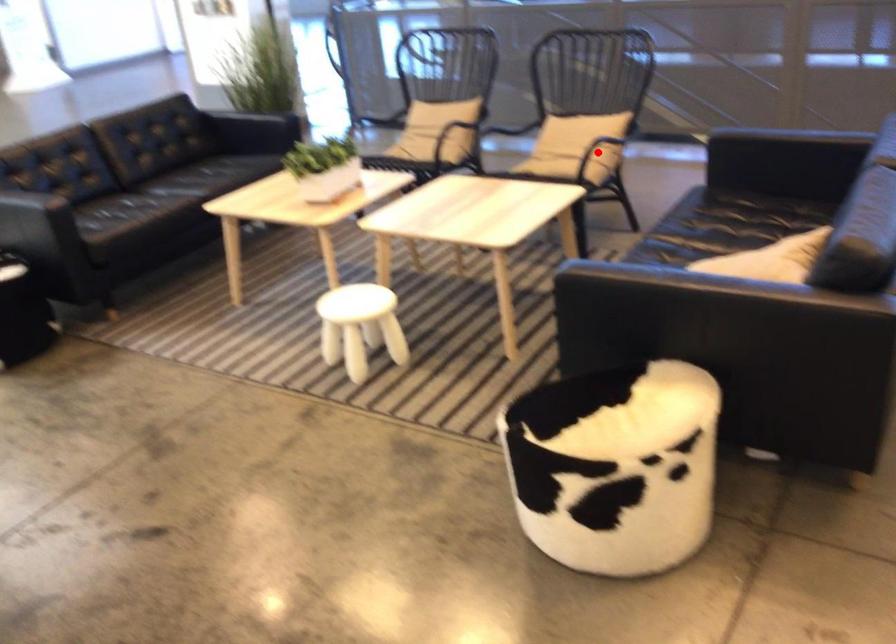
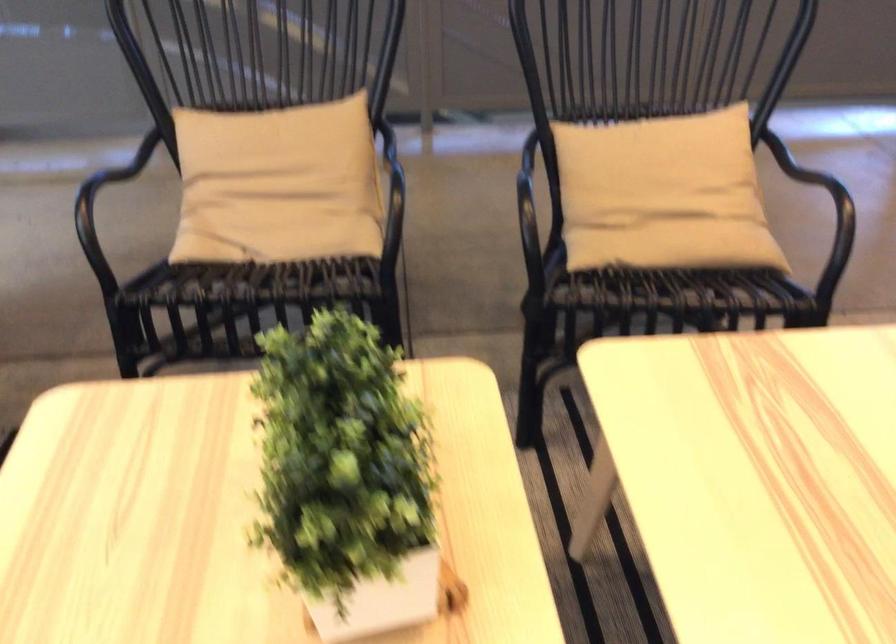
Question: I am providing you with two images of the same scene from different viewpoints. A red point is marked on the first image. At the location where the point appears in image 1, is it still visible in image 2?

Choices:
 (A) Yes
 (B) No

Answer: (B)